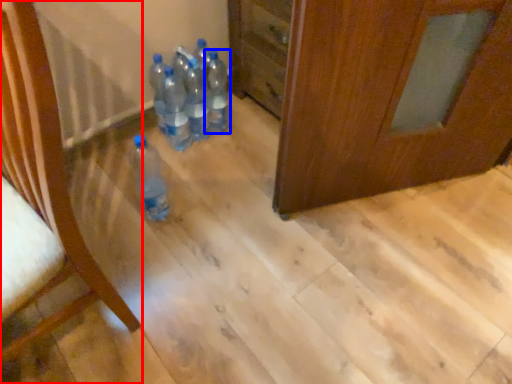
Question: Which of the following is the closest to the observer, furniture (highlighted by a red box) or bottle (highlighted by a blue box)?

Choices:
 (A) furniture
 (B) bottle

Answer: (A)